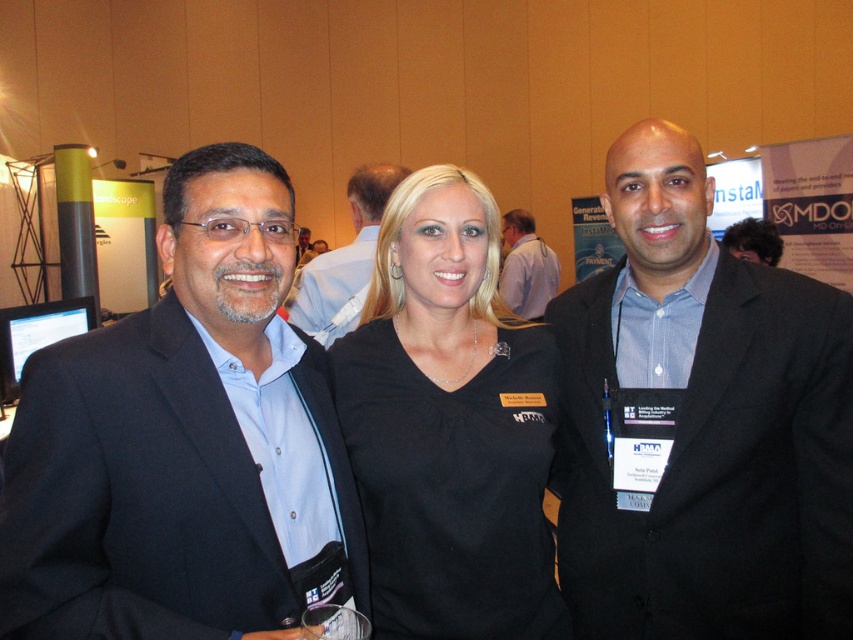
You are an event photographer at a professional conference. You need to capture a photo of the black suit at center and the dark curly hair at center. Based on their positions, which object should you focus on first to ensure both are in frame?

The black suit at center is positioned under dark curly hair at center, so you should focus on the dark curly hair at center first to ensure both are in frame.